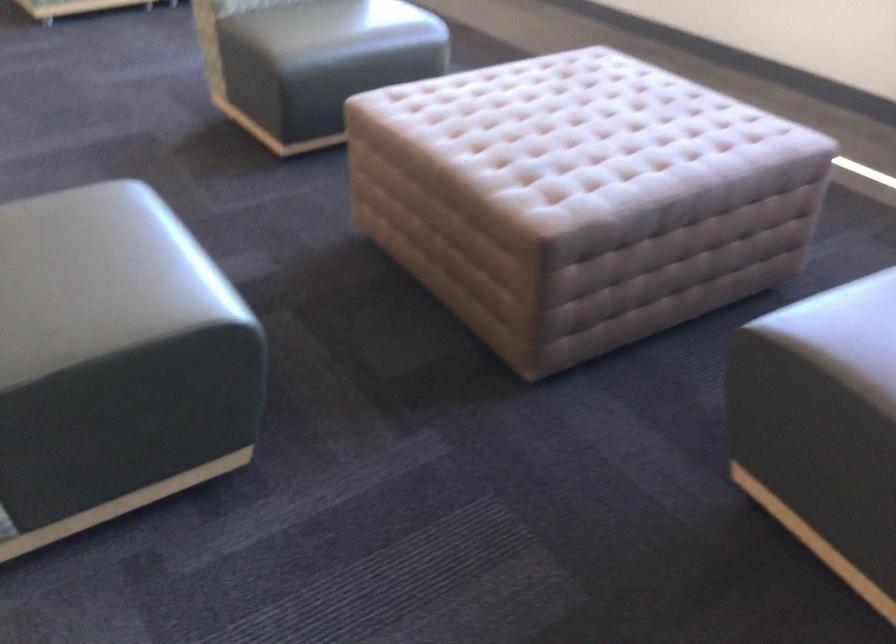
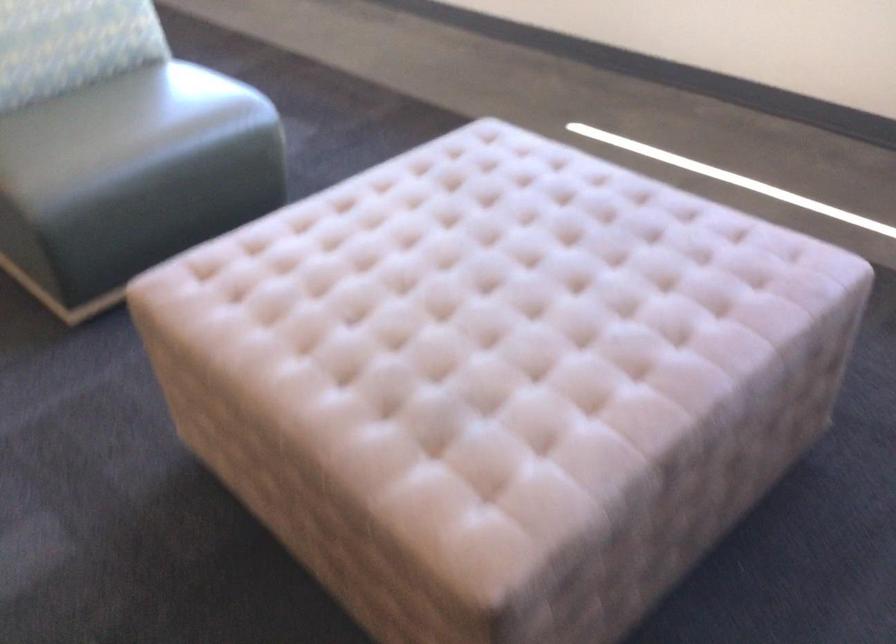
Question: In a continuous first-person perspective shot, in which direction is the camera moving?

Choices:
 (A) Left
 (B) Right
 (C) Forward
 (D) Backward

Answer: (C)